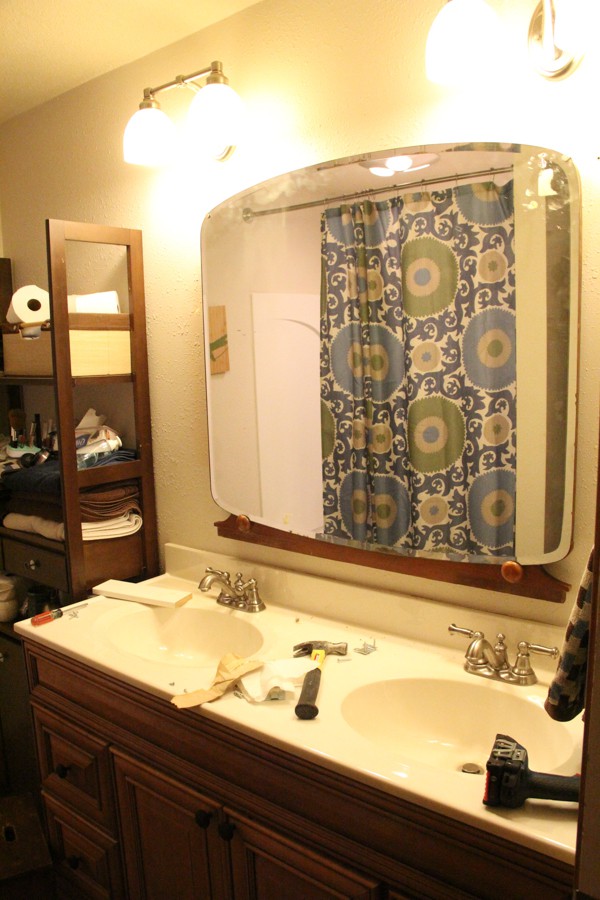
Identify the location of towel. (566, 695).